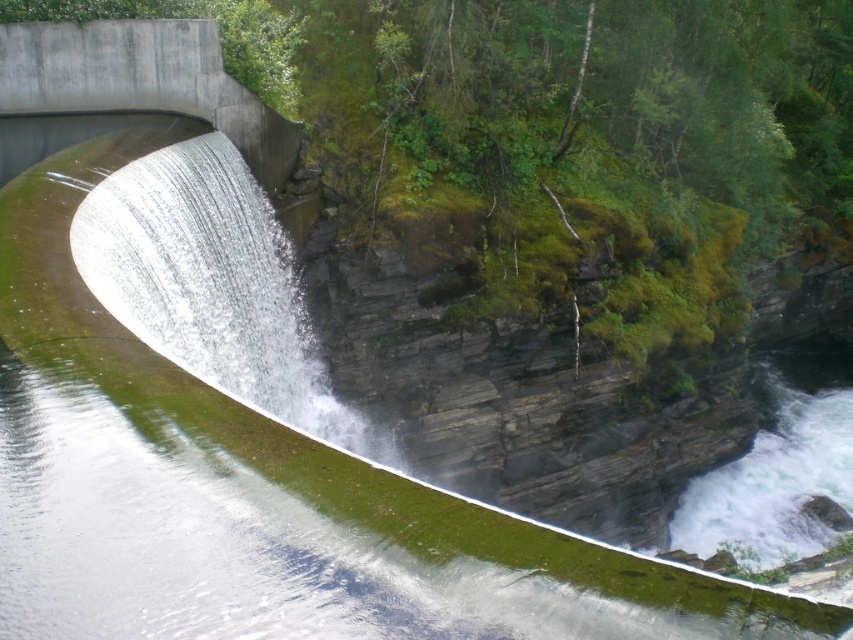
Does point (224, 346) come farther from viewer compared to point (74, 26)?

No, (224, 346) is in front of (74, 26).

Is clear water at center closer to the viewer compared to concrete bridge at upper left?

Yes, it is.

In the scene shown: Who is more forward, (x=119, y=188) or (x=74, y=106)?

Positioned in front is point (x=119, y=188).

The image size is (853, 640). I want to click on clear water at center, so click(213, 284).